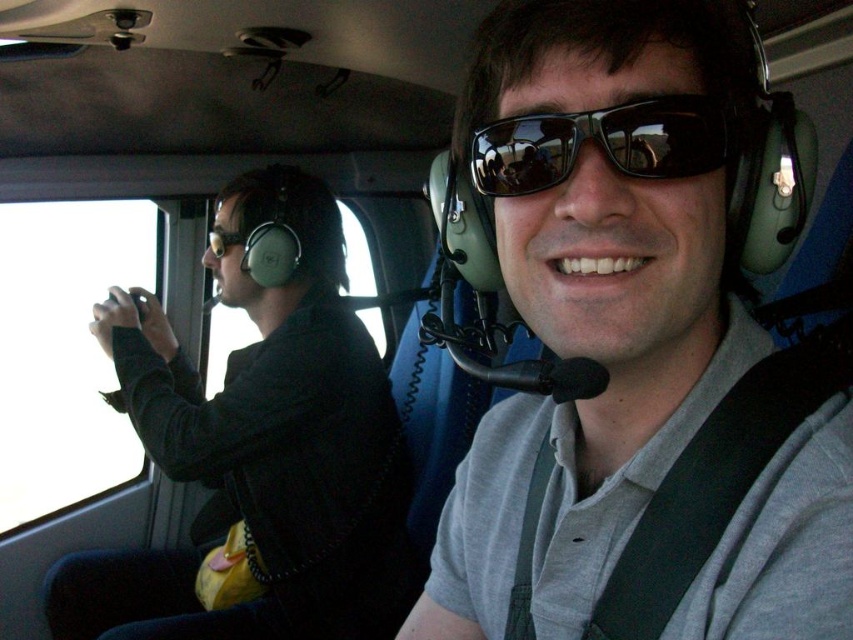
Question: Is matte black sunglasses at center thinner than black reflective sunglasses at center?

Choices:
 (A) no
 (B) yes

Answer: (A)

Question: Does matte black sunglasses at center have a greater width compared to black reflective sunglasses at center?

Choices:
 (A) yes
 (B) no

Answer: (A)

Question: Does black matte jacket at left have a lesser width compared to black reflective sunglasses at center?

Choices:
 (A) yes
 (B) no

Answer: (B)

Question: Estimate the real-world distances between objects in this image. Which object is farther from the matte black sunglasses at center?

Choices:
 (A) black reflective sunglasses at center
 (B) black matte jacket at left

Answer: (B)

Question: Which of these objects is positioned closest to the black reflective sunglasses at center?

Choices:
 (A) matte black sunglasses at center
 (B) black matte jacket at left

Answer: (A)

Question: Which point is farther from the camera taking this photo?

Choices:
 (A) (347, 349)
 (B) (697, 141)
 (C) (613, 209)

Answer: (A)